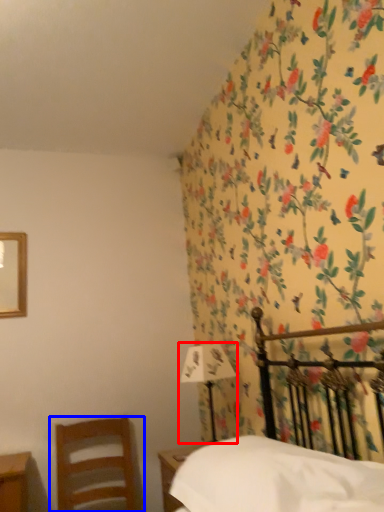
Question: Which point is closer to the camera, bedside lamp (highlighted by a red box) or chair (highlighted by a blue box)?

Choices:
 (A) bedside lamp
 (B) chair

Answer: (B)